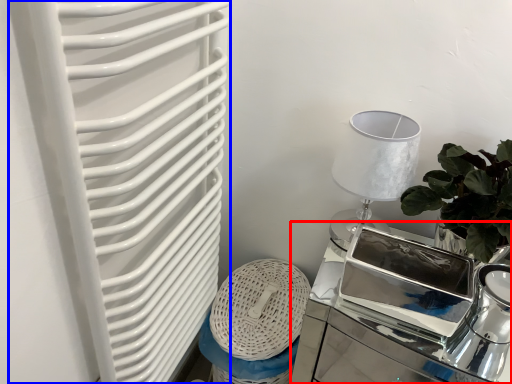
Question: Which object is closer to the camera taking this photo, table (highlighted by a red box) or radiator (highlighted by a blue box)?

Choices:
 (A) table
 (B) radiator

Answer: (B)